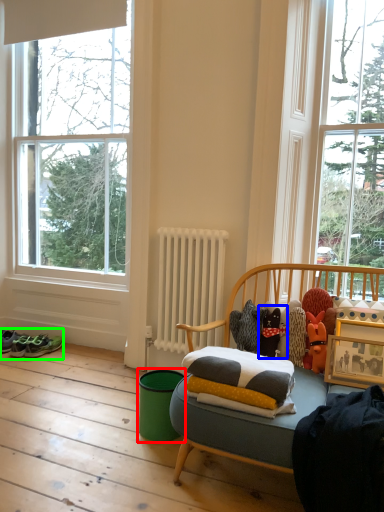
Question: Considering the real-world distances, which object is closest to teal (highlighted by a red box)? toy (highlighted by a blue box) or footwear (highlighted by a green box).

Choices:
 (A) toy
 (B) footwear

Answer: (A)